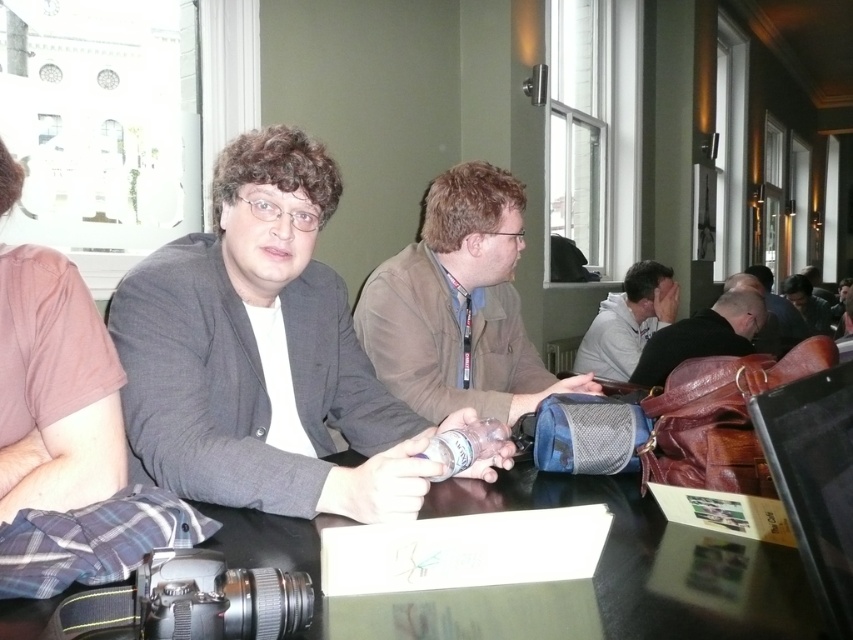
Is light brown leather jacket at center smaller than dark brown leather jacket at right?

Yes, light brown leather jacket at center is smaller than dark brown leather jacket at right.

Does light brown leather jacket at center have a larger size compared to dark brown leather jacket at right?

No, light brown leather jacket at center is not bigger than dark brown leather jacket at right.

Locate an element on the screen. The height and width of the screenshot is (640, 853). light brown leather jacket at center is located at coordinates (457, 305).

Who is shorter, brown cotton shirt at left or matte black jacket at center?

brown cotton shirt at left is shorter.

The width and height of the screenshot is (853, 640). Find the location of `brown cotton shirt at left`. brown cotton shirt at left is located at coordinates (65, 460).

Who is more forward, (772,300) or (813,298)?

Point (772,300) is more forward.

Where is `matte black jacket at center`? matte black jacket at center is located at coordinates (780, 308).